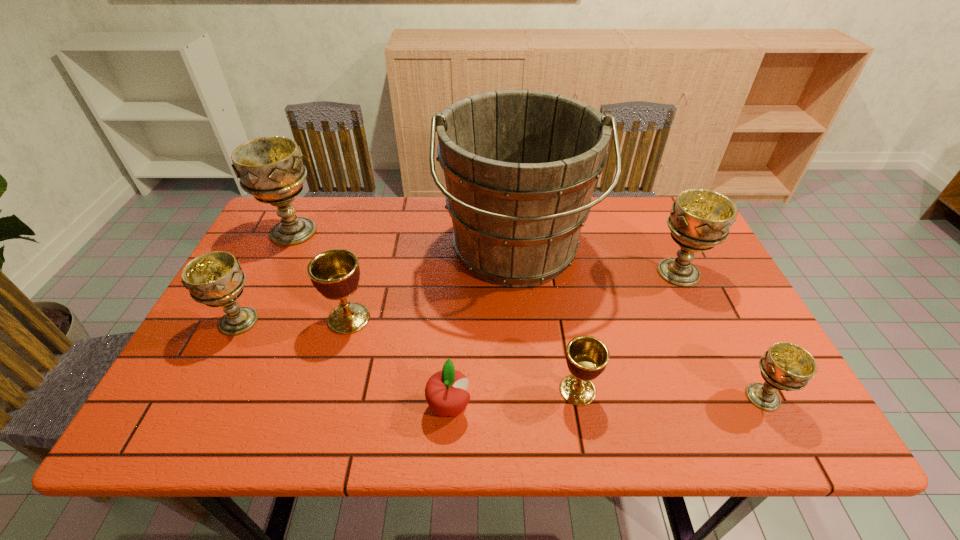
In order to click on free spot located 0.080m on the back of the red apple in this screenshot , I will do `click(452, 357)`.

This screenshot has height=540, width=960. What are the coordinates of `bucket that is at the far edge` in the screenshot? It's located at [520, 166].

Where is `chalice at the far edge`? Image resolution: width=960 pixels, height=540 pixels. chalice at the far edge is located at coordinates (270, 168).

Locate an element on the screen. apple at the near edge is located at coordinates (445, 392).

Locate an element on the screen. Image resolution: width=960 pixels, height=540 pixels. object that is positioned at the far left corner is located at coordinates (270, 168).

Find the location of `object that is positioned at the near right corner`. object that is positioned at the near right corner is located at coordinates (785, 366).

Where is `vacant space at the far edge of the desktop`? This screenshot has height=540, width=960. vacant space at the far edge of the desktop is located at coordinates (332, 229).

Where is `blank space at the right edge`? blank space at the right edge is located at coordinates (708, 259).

In the image, there is a desktop. At what (x,y) coordinates should I click in order to perform the action: click on blank space at the far left corner. Please return your answer as a coordinate pair (x, y). Looking at the image, I should click on (260, 235).

You are a GUI agent. You are given a task and a screenshot of the screen. Output one action in this format:
    pyautogui.click(x=<x>, y=<y>)
    Task: Click on the vacant space at the far right corner
    
    Given the screenshot: What is the action you would take?
    pyautogui.click(x=658, y=224)